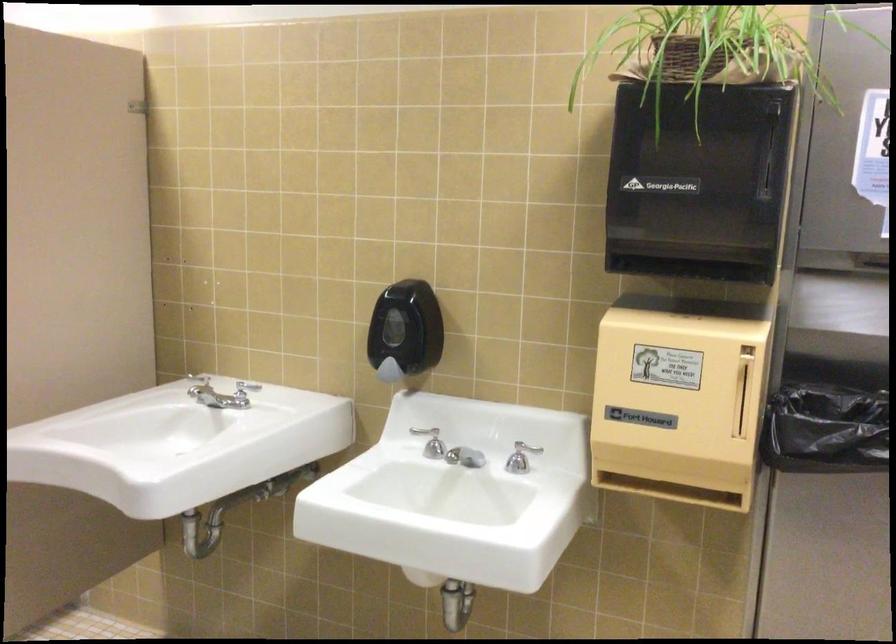
Find where to pull the towel dispenser lever. Please return your answer as a coordinate pair (x, y).

(698, 182)